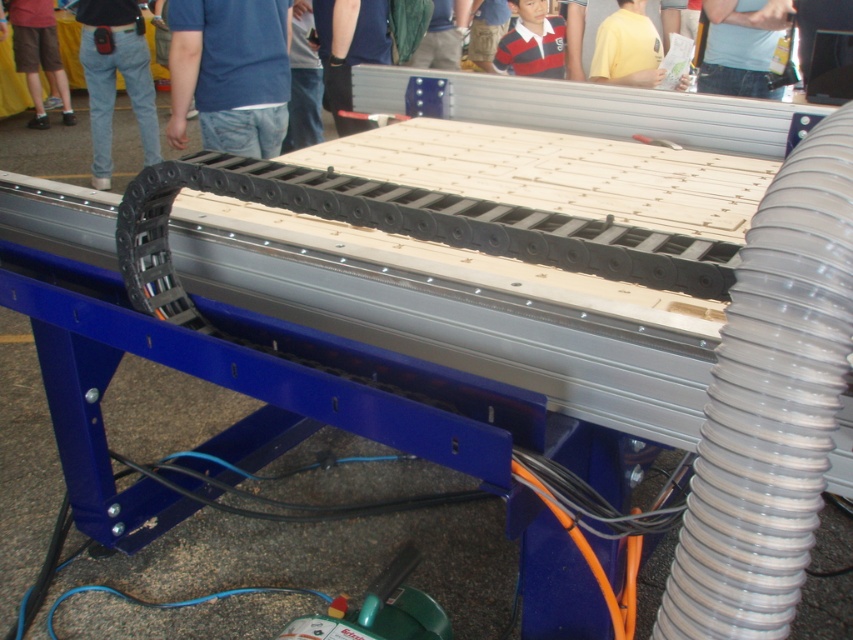
Question: Which object is farther from the camera taking this photo?

Choices:
 (A) yellow matte shirt at upper center
 (B) blue denim jeans at center
 (C) denim jeans at left

Answer: (C)

Question: Is blue denim jeans at center smaller than striped polo shirt at upper center?

Choices:
 (A) yes
 (B) no

Answer: (A)

Question: Which of the following is the farthest from the observer?

Choices:
 (A) (761, 76)
 (B) (122, 1)

Answer: (B)

Question: Which object is closer to the camera taking this photo?

Choices:
 (A) blue denim jeans at center
 (B) blue denim shorts at center
 (C) brown cotton shorts at lower left

Answer: (B)

Question: Is denim jeans at left bigger than yellow matte shirt at upper center?

Choices:
 (A) no
 (B) yes

Answer: (A)

Question: Does blue denim shorts at center come in front of yellow matte shirt at upper center?

Choices:
 (A) yes
 (B) no

Answer: (A)